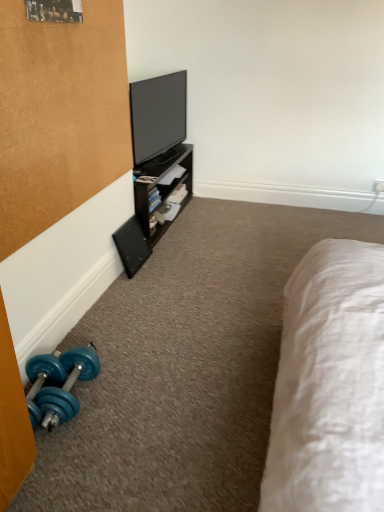
Question: From the image's perspective, is blue rubber dumbbell at lower left beneath flat screen tv at upper center?

Choices:
 (A) no
 (B) yes

Answer: (B)

Question: Is blue rubber dumbbell at lower left outside flat screen tv at upper center?

Choices:
 (A) yes
 (B) no

Answer: (A)

Question: From a real-world perspective, does blue rubber dumbbell at lower left stand above flat screen tv at upper center?

Choices:
 (A) no
 (B) yes

Answer: (A)

Question: Considering the relative sizes of blue rubber dumbbell at lower left and flat screen tv at upper center in the image provided, is blue rubber dumbbell at lower left smaller than flat screen tv at upper center?

Choices:
 (A) no
 (B) yes

Answer: (B)

Question: Is blue rubber dumbbell at lower left at the left side of flat screen tv at upper center?

Choices:
 (A) no
 (B) yes

Answer: (B)

Question: Is flat screen tv at upper center surrounded by blue rubber dumbbell at lower left?

Choices:
 (A) no
 (B) yes

Answer: (A)

Question: Can you confirm if flat screen tv at upper center is taller than blue rubber dumbbell at lower left?

Choices:
 (A) no
 (B) yes

Answer: (B)

Question: Is flat screen tv at upper center looking in the opposite direction of blue rubber dumbbell at lower left?

Choices:
 (A) no
 (B) yes

Answer: (A)

Question: Is flat screen tv at upper center bigger than blue rubber dumbbell at lower left?

Choices:
 (A) no
 (B) yes

Answer: (B)

Question: Is flat screen tv at upper center positioned beyond the bounds of blue rubber dumbbell at lower left?

Choices:
 (A) no
 (B) yes

Answer: (B)

Question: Is flat screen tv at upper center in contact with blue rubber dumbbell at lower left?

Choices:
 (A) yes
 (B) no

Answer: (B)

Question: Does flat screen tv at upper center have a lesser height compared to blue rubber dumbbell at lower left?

Choices:
 (A) no
 (B) yes

Answer: (A)

Question: Is flat screen tv at upper center a part of black matte speaker at lower left?

Choices:
 (A) no
 (B) yes

Answer: (A)